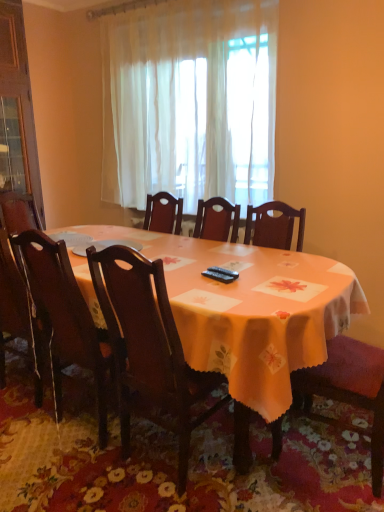
The height and width of the screenshot is (512, 384). What are the coordinates of `free location to the right of dark wood chair at center, placed as the 2th chair when sorted from left to right` in the screenshot? It's located at (266, 475).